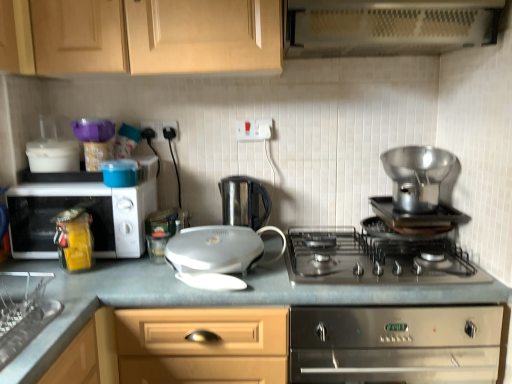
Find the location of a particular element. Image resolution: width=512 pixels, height=384 pixels. blank space to the left of white glossy sandwich maker at center, placed as the third kitchen appliance when sorted from right to left is located at coordinates (136, 276).